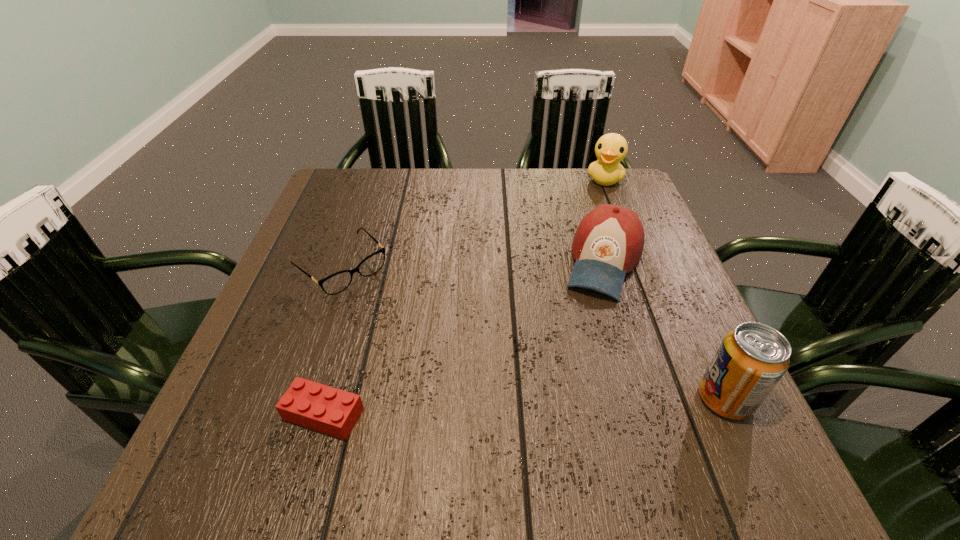
Identify the location of vacant space at the far left corner of the desktop. The image size is (960, 540). (350, 207).

Locate an element on the screen. vacant space at the near right corner of the desktop is located at coordinates point(693,386).

The width and height of the screenshot is (960, 540). What are the coordinates of `unoccupied position between the spectacles and the third shortest object` in the screenshot? It's located at (472, 265).

The image size is (960, 540). Identify the location of vacant space that is in between the Lego and the third shortest object. (464, 338).

This screenshot has height=540, width=960. I want to click on empty space that is in between the third tallest object and the spectacles, so click(x=472, y=265).

Locate an element on the screen. vacant point located between the farthest object and the spectacles is located at coordinates (473, 224).

Where is `blank region between the third shortest object and the soda can`? The image size is (960, 540). blank region between the third shortest object and the soda can is located at coordinates (664, 330).

Identify the location of free space between the soda can and the farthest object. (664, 289).

What are the coordinates of `free space between the baseball cap and the soda can` in the screenshot? It's located at (664, 330).

I want to click on free spot between the third tallest object and the soda can, so click(664, 330).